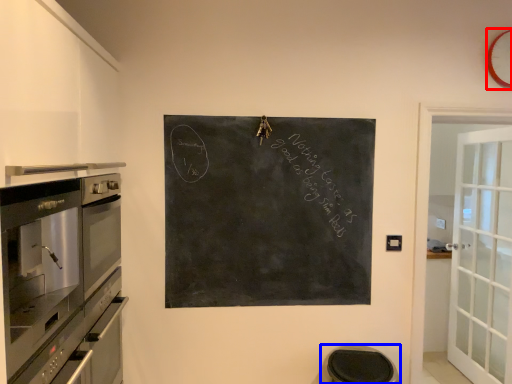
Question: Which object appears closest to the camera in this image, clock (highlighted by a red box) or step stool (highlighted by a blue box)?

Choices:
 (A) clock
 (B) step stool

Answer: (B)